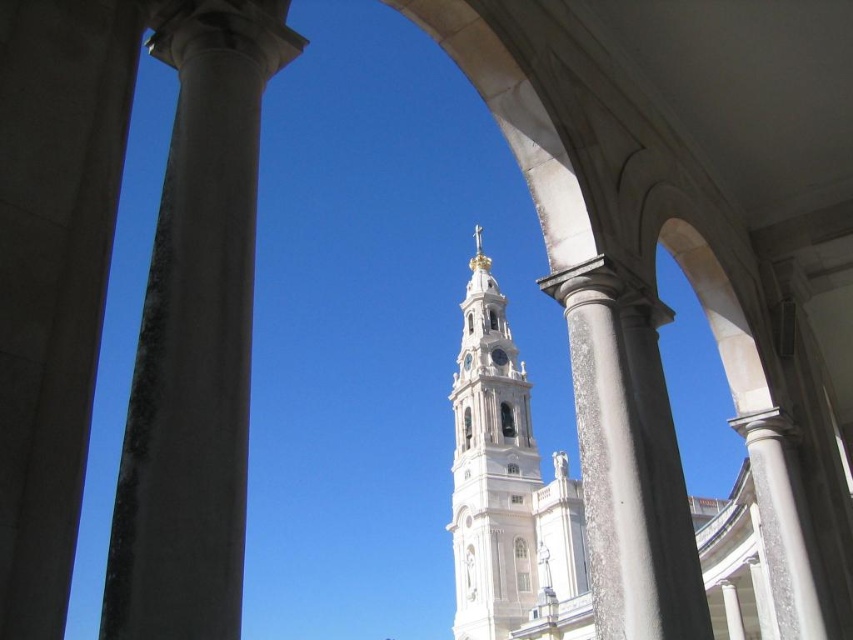
You are an architect designing a new colonnade and want to ensure structural stability. Given the white stone column at left and the white marble column at center, which column should you replicate for a stronger support structure?

The white marble column at center is thicker, providing greater structural support, so it should be replicated for a stronger support structure.

You are standing at the entrance of the colonnade and want to take a photo of the church tower. To ensure the white marble column at center is in the foreground, where should you position yourself relative to the column?

You should position yourself in front of the white marble column at center to have it in the foreground of your photo.

You are standing at the center of the colonnade looking towards the church tower. Which direction should you turn to face the white marble column represented by point (195, 337)?

You should turn to your left to face the white marble column represented by point (195, 337) since it is located at the left side of the scene.